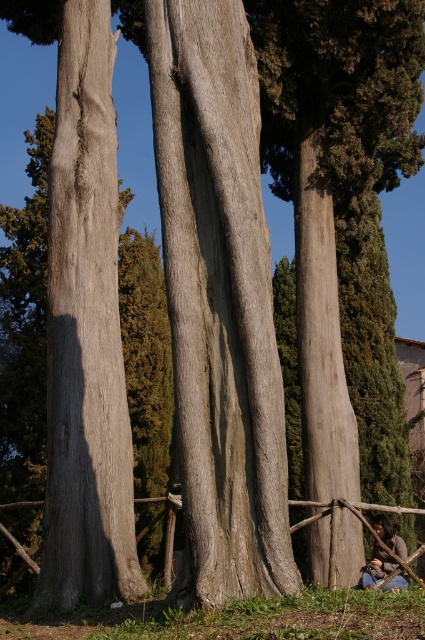
Question: Is wooden at center below dark brown leather jacket at lower right?

Choices:
 (A) no
 (B) yes

Answer: (A)

Question: Which point appears farthest from the camera in this image?

Choices:
 (A) (246, 145)
 (B) (325, 506)
 (C) (368, 580)
 (D) (102, 452)

Answer: (C)

Question: Among these objects, which one is nearest to the camera?

Choices:
 (A) gray rough bark tree trunk at center
 (B) dark brown leather jacket at lower right
 (C) gray rough bark tree trunk at left
 (D) wooden at center

Answer: (A)

Question: Does gray rough bark tree trunk at left have a larger size compared to wooden at center?

Choices:
 (A) yes
 (B) no

Answer: (A)

Question: Among these objects, which one is nearest to the camera?

Choices:
 (A) gray rough bark tree trunk at center
 (B) dark brown leather jacket at lower right

Answer: (A)

Question: Can you confirm if gray rough bark tree trunk at left is smaller than dark brown leather jacket at lower right?

Choices:
 (A) yes
 (B) no

Answer: (B)